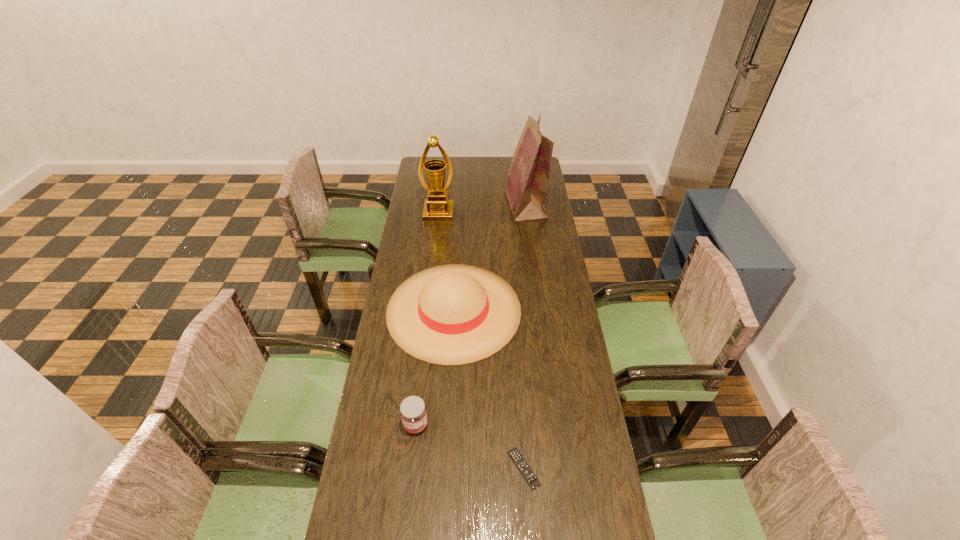
Find the location of `empty space that is in between the second nearest object and the sombrero`. empty space that is in between the second nearest object and the sombrero is located at coordinates (435, 367).

The height and width of the screenshot is (540, 960). I want to click on object that is the second closest to the third nearest object, so click(515, 455).

The image size is (960, 540). In order to click on object that is the third closest to the sombrero in this screenshot , I will do `click(526, 185)`.

Where is `free location that satisfies the following two spatial constraints: 1. on the front-facing side of the award; 2. on the right side of the second shortest object`? The width and height of the screenshot is (960, 540). free location that satisfies the following two spatial constraints: 1. on the front-facing side of the award; 2. on the right side of the second shortest object is located at coordinates (415, 425).

Where is `vacant position in the image that satisfies the following two spatial constraints: 1. on the front-facing side of the grocery bag; 2. on the front side of the fourth tallest object`? The width and height of the screenshot is (960, 540). vacant position in the image that satisfies the following two spatial constraints: 1. on the front-facing side of the grocery bag; 2. on the front side of the fourth tallest object is located at coordinates (554, 425).

Locate an element on the screen. vacant region that satisfies the following two spatial constraints: 1. on the front-facing side of the sombrero; 2. on the right side of the award is located at coordinates (428, 310).

Image resolution: width=960 pixels, height=540 pixels. I want to click on vacant space that satisfies the following two spatial constraints: 1. on the front-facing side of the award; 2. on the right side of the second shortest object, so click(x=415, y=425).

I want to click on vacant space that satisfies the following two spatial constraints: 1. on the front-facing side of the award; 2. on the left side of the second shortest object, so click(415, 425).

The width and height of the screenshot is (960, 540). Find the location of `vacant area in the image that satisfies the following two spatial constraints: 1. on the front-facing side of the shortest object; 2. on the left side of the award`. vacant area in the image that satisfies the following two spatial constraints: 1. on the front-facing side of the shortest object; 2. on the left side of the award is located at coordinates (410, 469).

You are a GUI agent. You are given a task and a screenshot of the screen. Output one action in this format:
    pyautogui.click(x=<x>, y=<y>)
    Task: Click on the blank area in the image that satisfies the following two spatial constraints: 1. on the front-facing side of the sombrero; 2. on the right side of the award
    
    Given the screenshot: What is the action you would take?
    pyautogui.click(x=428, y=310)